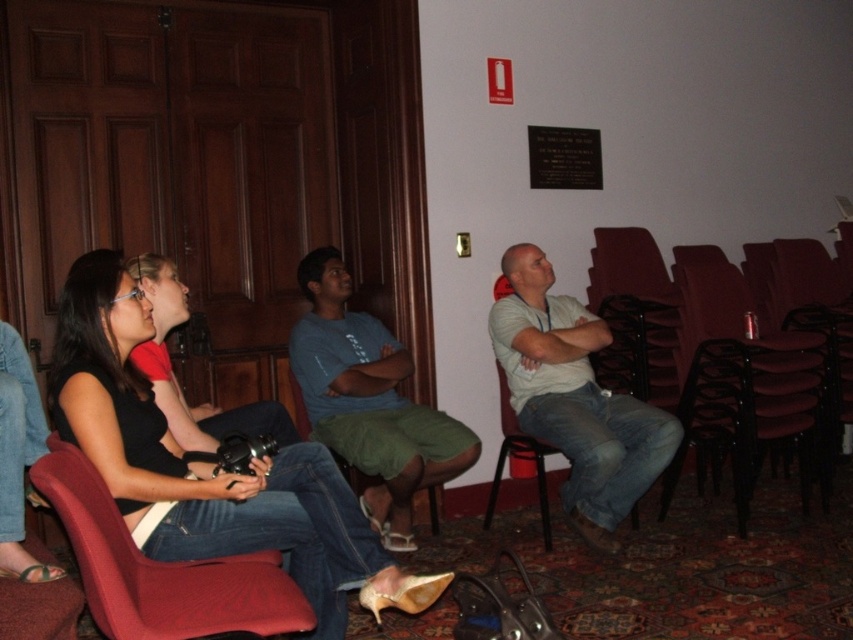
Question: Which object appears farthest from the camera in this image?

Choices:
 (A) green fabric shorts at center
 (B) black plastic chair at center
 (C) light gray cotton shirt at center

Answer: (A)

Question: Estimate the real-world distances between objects in this image. Which object is closer to the blue cotton shirt at center?

Choices:
 (A) matte black camera at lower left
 (B) black plastic chair at center
 (C) matte black camera at left
 (D) green fabric shorts at center

Answer: (D)

Question: Can you confirm if matte black camera at left is positioned above black plastic chair at center?

Choices:
 (A) no
 (B) yes

Answer: (B)

Question: Among these points, which one is farthest from the camera?

Choices:
 (A) (164, 342)
 (B) (355, 470)

Answer: (B)

Question: Considering the relative positions of velvet red chair at lower left and black plastic chair at center in the image provided, where is velvet red chair at lower left located with respect to black plastic chair at center?

Choices:
 (A) right
 (B) left

Answer: (B)

Question: Can you confirm if matte black camera at left is positioned to the right of black plastic chair at center?

Choices:
 (A) no
 (B) yes

Answer: (A)